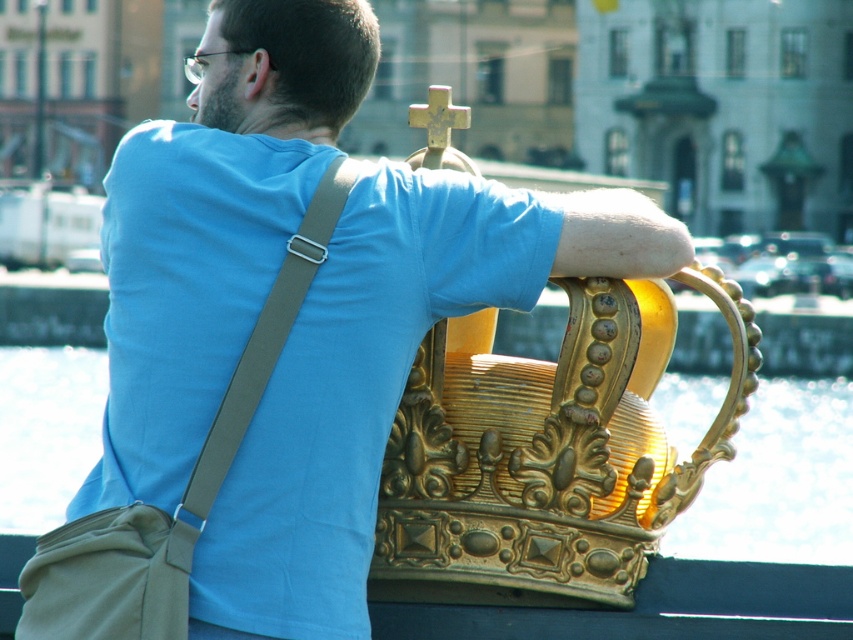
Question: Estimate the real-world distances between objects in this image. Which object is farther from the gray fabric strap at upper left?

Choices:
 (A) rusty metal cross at upper center
 (B) gold metallic water at upper center

Answer: (B)

Question: Based on their relative distances, which object is nearer to the rusty metal cross at upper center?

Choices:
 (A) gold metallic water at upper center
 (B) gray fabric strap at upper left

Answer: (B)

Question: In this image, where is gray fabric strap at upper left located relative to rusty metal cross at upper center?

Choices:
 (A) left
 (B) right

Answer: (A)

Question: Does gray fabric strap at upper left appear on the right side of rusty metal cross at upper center?

Choices:
 (A) no
 (B) yes

Answer: (A)

Question: Is gray fabric strap at upper left thinner than rusty metal cross at upper center?

Choices:
 (A) yes
 (B) no

Answer: (A)

Question: Which object appears farthest from the camera in this image?

Choices:
 (A) gray fabric strap at upper left
 (B) gold metallic water at upper center
 (C) rusty metal cross at upper center

Answer: (C)